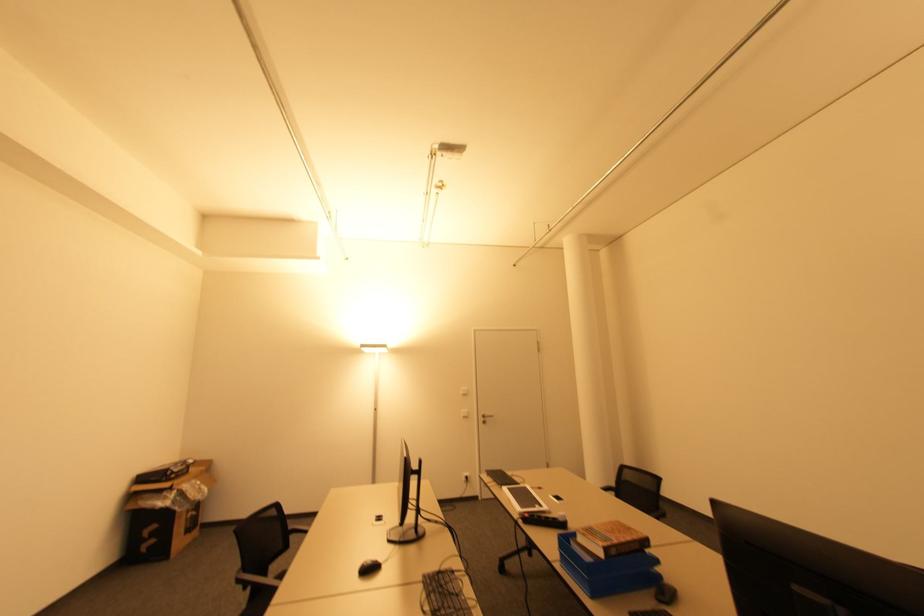
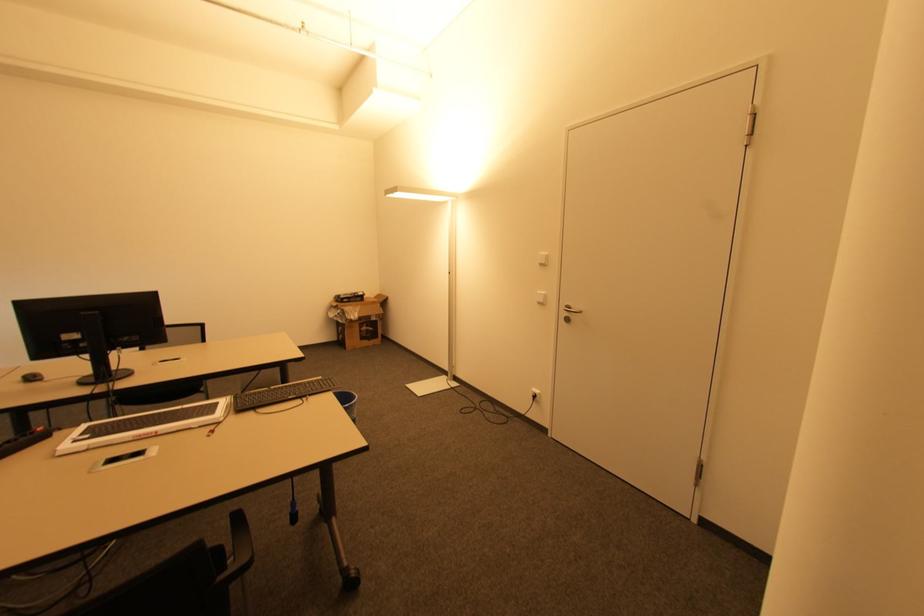
Find the pixel in the second image that matches point 467,416 in the first image.

(541, 302)